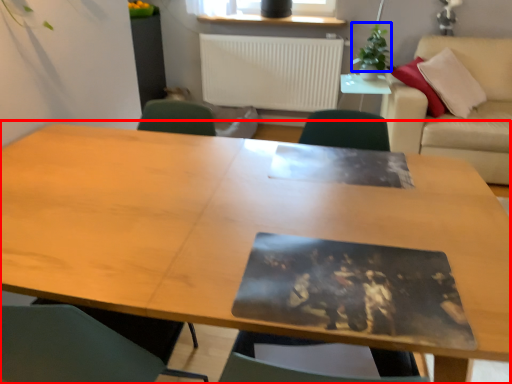
Question: Which object is further to the camera taking this photo, table (highlighted by a red box) or plant (highlighted by a blue box)?

Choices:
 (A) table
 (B) plant

Answer: (B)